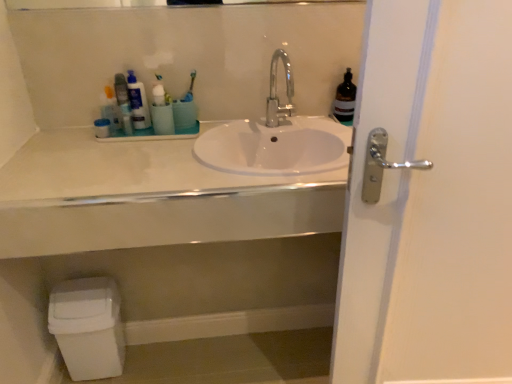
Find the location of a particular element. free space above white glossy sink at center (from a real-world perspective) is located at coordinates (154, 150).